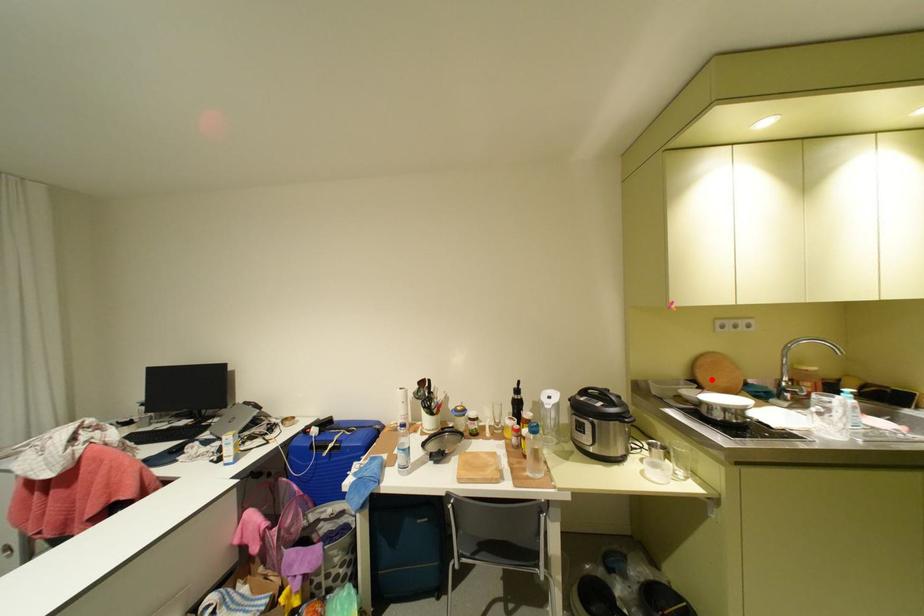
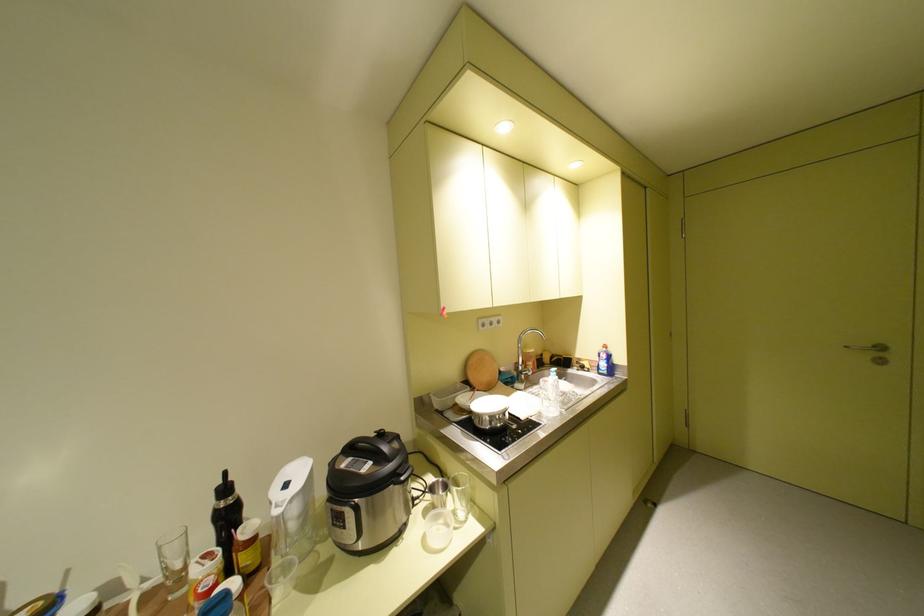
In the second image, find the point that corresponds to the highlighted location in the first image.

(482, 379)